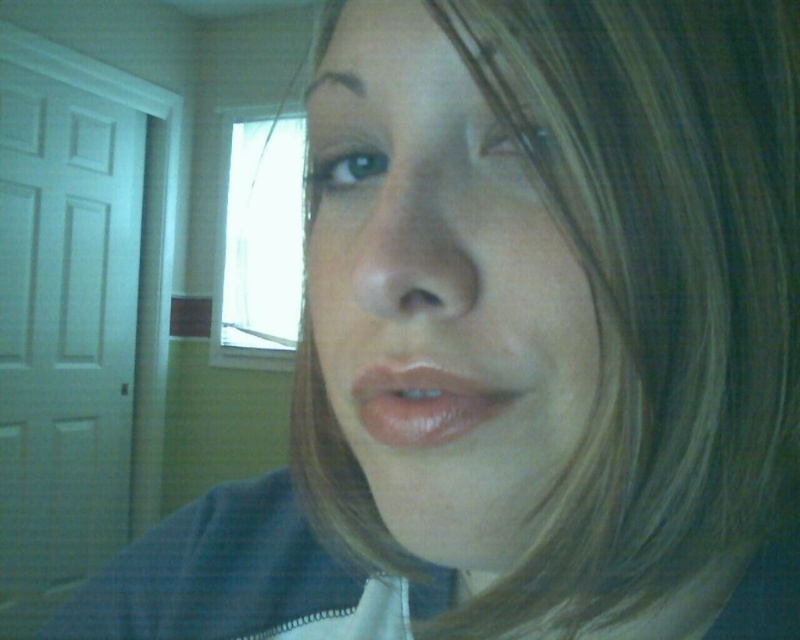
Which of these two, smooth skin face at center or shiny pink lips at center, stands taller?

smooth skin face at center is taller.

Is point (406, 312) more distant than point (450, 378)?

No, it is not.

Locate an element on the screen. smooth skin face at center is located at coordinates (438, 292).